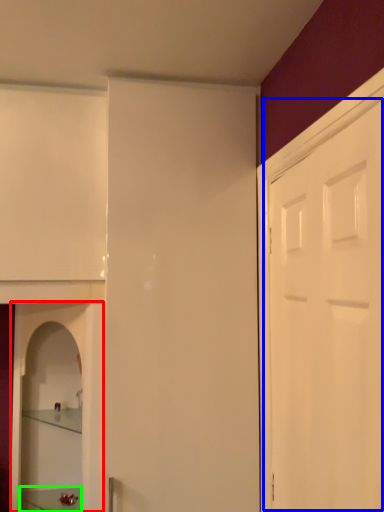
Question: Which object is positioned closest to cabinetry (highlighted by a red box)? Select from door (highlighted by a blue box) and furniture (highlighted by a green box).

Choices:
 (A) door
 (B) furniture

Answer: (B)